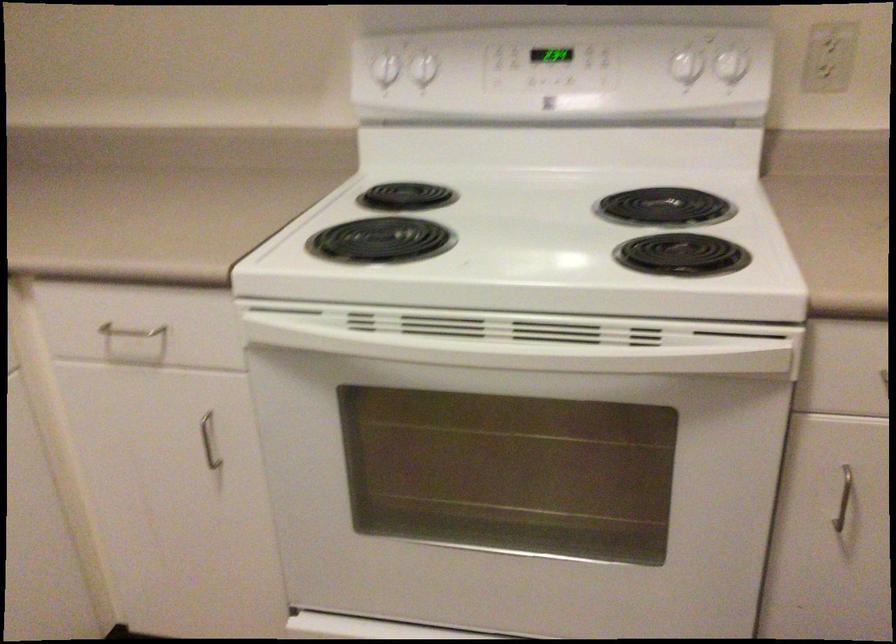
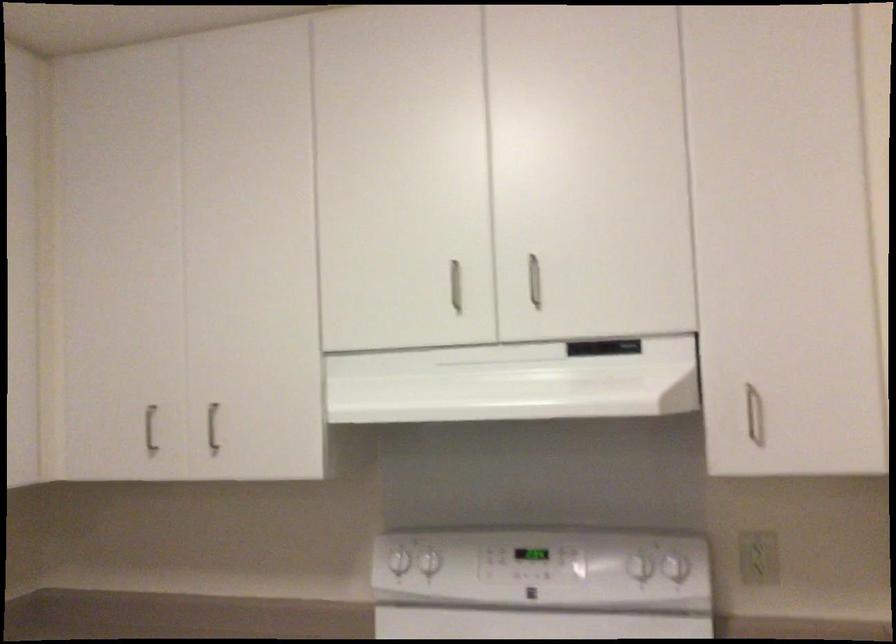
Question: The first image is from the beginning of the video and the second image is from the end. How did the camera likely rotate when shooting the video?

Choices:
 (A) Left
 (B) Right
 (C) Up
 (D) Down

Answer: (C)